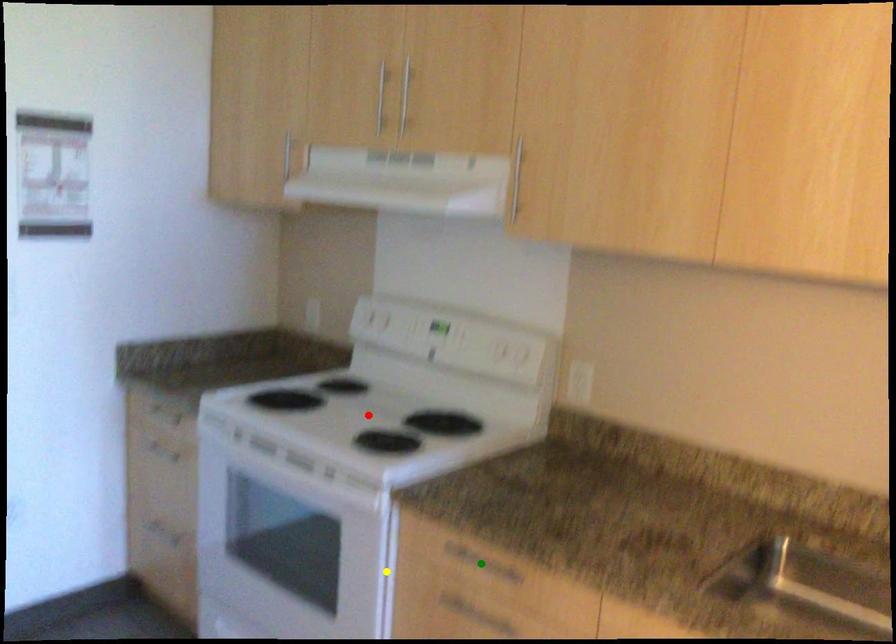
Order these from nearest to farthest:
yellow point
red point
green point

green point < yellow point < red point